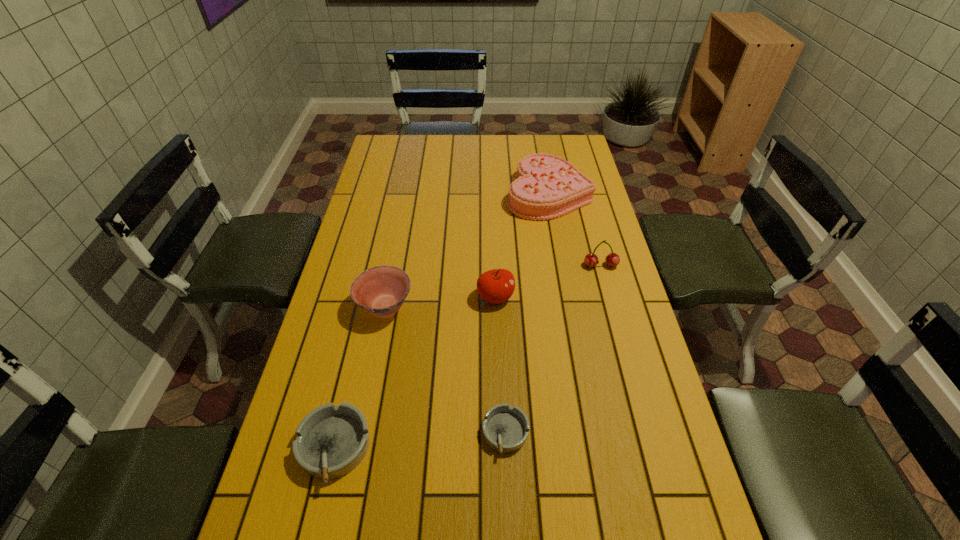
You are a GUI agent. You are given a task and a screenshot of the screen. Output one action in this format:
    pyautogui.click(x=<x>, y=<y>)
    Task: Click on the free space at the left edge
    Image resolution: width=960 pixels, height=540 pixels.
    Given the screenshot: What is the action you would take?
    pyautogui.click(x=347, y=259)

At what (x,y) coordinates should I click in order to perform the action: click on vacant space at the right edge of the desktop. Please return your answer as a coordinate pair (x, y). This screenshot has width=960, height=540. Looking at the image, I should click on (646, 417).

Where is `free space at the far left corner`? The width and height of the screenshot is (960, 540). free space at the far left corner is located at coordinates (383, 151).

This screenshot has height=540, width=960. I want to click on free space at the far right corner, so click(x=567, y=147).

Identify the location of empty location between the right ashtray and the fifth nearest object. The image size is (960, 540). (553, 349).

Find the location of a particular element. vacant space that is in between the farthest object and the cherry is located at coordinates (575, 230).

At what (x,y) coordinates should I click in order to perform the action: click on empty location between the fifth tallest object and the shorter ashtray. Please return your answer as a coordinate pair (x, y). Image resolution: width=960 pixels, height=540 pixels. Looking at the image, I should click on (420, 441).

Where is `unoccupied area between the cake and the cherry`? The height and width of the screenshot is (540, 960). unoccupied area between the cake and the cherry is located at coordinates (575, 230).

Where is `vacant point located between the bowl and the shorter ashtray`? vacant point located between the bowl and the shorter ashtray is located at coordinates (445, 370).

Find the location of a particular element. The image size is (960, 540). vacant point located between the shorter ashtray and the bowl is located at coordinates (445, 370).